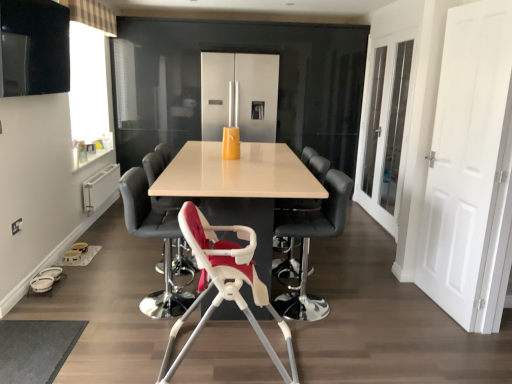
What do you see at coordinates (240, 94) in the screenshot? This screenshot has width=512, height=384. I see `satin silver fridge at center` at bounding box center [240, 94].

This screenshot has width=512, height=384. What do you see at coordinates (309, 244) in the screenshot?
I see `black leather bar stool at center, which is the 3th chair from back to front` at bounding box center [309, 244].

Consider the image. What is the approximate height of white plastic highchair at center, arranged as the fourth chair when viewed from the back?

It is 35.68 inches.

This screenshot has width=512, height=384. I want to click on black leather chair at center, the 5th chair in the front-to-back sequence, so click(x=286, y=258).

Measure the distance between point (166, 205) and camera.

The distance of point (166, 205) from camera is 10.29 feet.

Find the location of a particular element. The image size is (512, 384). matte white table at center is located at coordinates (240, 187).

From a real-world perspective, does satin silver fridge at center stand above white plastic highchair at center, the fifth chair when ordered from back to front?

Yes, from a real-world perspective, satin silver fridge at center is above white plastic highchair at center, the fifth chair when ordered from back to front.

Is satin silver fridge at center at the right side of white plastic highchair at center, the fifth chair when ordered from back to front?

Incorrect, satin silver fridge at center is not on the right side of white plastic highchair at center, the fifth chair when ordered from back to front.

Is satin silver fridge at center aimed at white plastic highchair at center, placed as the first chair when sorted from front to back?

Yes, satin silver fridge at center is aimed at white plastic highchair at center, placed as the first chair when sorted from front to back.

From their relative heights in the image, would you say satin silver fridge at center is taller or shorter than white plastic highchair at center, the fifth chair when ordered from back to front?

Considering their sizes, satin silver fridge at center has more height than white plastic highchair at center, the fifth chair when ordered from back to front.

Considering the positions of point (314, 233) and point (499, 2), is point (314, 233) closer or farther from the camera than point (499, 2)?

Point (314, 233) appears to be farther away from the viewer than point (499, 2).

From the image's perspective, relative to white matte door at right, is black leather bar stool at center, placed as the third chair when sorted from front to back, above or below?

Based on their image positions, black leather bar stool at center, placed as the third chair when sorted from front to back, is located beneath white matte door at right.

Which of these two, black leather bar stool at center, placed as the third chair when sorted from front to back, or white matte door at right, is bigger?

black leather bar stool at center, placed as the third chair when sorted from front to back.

What's the angular difference between black leather bar stool at center, which is the 3th chair from back to front, and white matte door at right's facing directions?

black leather bar stool at center, which is the 3th chair from back to front, and white matte door at right are facing 3.62 degrees away from each other.

Does satin silver fridge at center have a lesser width compared to black leather bar stool at center, which is the 3th chair from back to front?

Incorrect, the width of satin silver fridge at center is not less than that of black leather bar stool at center, which is the 3th chair from back to front.

Which is behind, satin silver fridge at center or black leather bar stool at center, placed as the third chair when sorted from front to back?

satin silver fridge at center is further from the camera.

From the image's perspective, would you say satin silver fridge at center is shown under black leather bar stool at center, which is the 3th chair from back to front?

Actually, satin silver fridge at center appears above black leather bar stool at center, which is the 3th chair from back to front, in the image.

From a real-world perspective, between satin silver fridge at center and black leather bar stool at center, placed as the third chair when sorted from front to back, who is vertically lower?

From a 3D spatial view, black leather bar stool at center, placed as the third chair when sorted from front to back, is below.

Which object is more forward, black leather chair at center, the 5th chair in the front-to-back sequence, or black leather bar stool at center, which is the 3th chair from back to front?

black leather bar stool at center, which is the 3th chair from back to front.

Is black leather chair at center, the first chair when ordered from back to front, aimed at black leather bar stool at center, placed as the third chair when sorted from front to back?

No, black leather chair at center, the first chair when ordered from back to front, does not turn towards black leather bar stool at center, placed as the third chair when sorted from front to back.

Looking at their sizes, would you say black leather chair at center, the 5th chair in the front-to-back sequence, is wider or thinner than black leather bar stool at center, placed as the third chair when sorted from front to back?

Clearly, black leather chair at center, the 5th chair in the front-to-back sequence, has less width compared to black leather bar stool at center, placed as the third chair when sorted from front to back.

From a real-world perspective, is black leather chair at center, the 5th chair in the front-to-back sequence, located beneath black leather bar stool at center, placed as the third chair when sorted from front to back?

Indeed, from a real-world perspective, black leather chair at center, the 5th chair in the front-to-back sequence, is positioned beneath black leather bar stool at center, placed as the third chair when sorted from front to back.

In terms of width, does white matte door at right look wider or thinner when compared to black leather bar stool at center, which is the 3th chair from back to front?

Clearly, white matte door at right has less width compared to black leather bar stool at center, which is the 3th chair from back to front.

Is black leather bar stool at center, placed as the third chair when sorted from front to back, surrounded by white matte door at right?

Definitely not — black leather bar stool at center, placed as the third chair when sorted from front to back, is not inside white matte door at right.

Consider the image. Which object is positioned more to the left, white matte door at right or black leather bar stool at center, placed as the third chair when sorted from front to back?

black leather bar stool at center, placed as the third chair when sorted from front to back, is more to the left.

Relative to white glass door at right, is black leather bar stool at center, placed as the third chair when sorted from front to back, in front or behind?

black leather bar stool at center, placed as the third chair when sorted from front to back, is in front of white glass door at right.

From the image's perspective, which one is positioned lower, black leather bar stool at center, which is the 3th chair from back to front, or white glass door at right?

black leather bar stool at center, which is the 3th chair from back to front, appears lower in the image.

Locate an element on the screen. The height and width of the screenshot is (384, 512). glass door that is behind the black leather bar stool at center, placed as the third chair when sorted from front to back is located at coordinates (385, 129).

Considering the sizes of objects black leather bar stool at center, placed as the third chair when sorted from front to back, and white glass door at right in the image provided, who is taller, black leather bar stool at center, placed as the third chair when sorted from front to back, or white glass door at right?

white glass door at right is taller.

Where is `table in front of the black leather chair at center, the first chair when ordered from back to front`? The height and width of the screenshot is (384, 512). table in front of the black leather chair at center, the first chair when ordered from back to front is located at coordinates pyautogui.click(x=240, y=187).

Is matte white table at center inside or outside of black leather chair at center, the 5th chair in the front-to-back sequence?

matte white table at center exists outside the volume of black leather chair at center, the 5th chair in the front-to-back sequence.

Is matte white table at center bigger or smaller than black leather chair at center, the 5th chair in the front-to-back sequence?

Considering their sizes, matte white table at center takes up more space than black leather chair at center, the 5th chair in the front-to-back sequence.

Is matte white table at center facing away from black leather chair at center, the 5th chair in the front-to-back sequence?

Yes, matte white table at center is positioned with its back facing black leather chair at center, the 5th chair in the front-to-back sequence.

The image size is (512, 384). Find the location of `chair that is the 5th object located in front of the satin silver fridge at center`. chair that is the 5th object located in front of the satin silver fridge at center is located at coordinates (224, 285).

The image size is (512, 384). I want to click on door above the black leather bar stool at center, placed as the third chair when sorted from front to back (from the image's perspective), so click(x=471, y=170).

Based on their spatial positions, is satin silver fridge at center or white glass door at right further from black leather bar stool at center, placed as the third chair when sorted from front to back?

satin silver fridge at center.

From the image, which object appears to be farther from black leather bar stool at center, placed as the third chair when sorted from front to back, white plastic highchair at center, positioned as the 2th chair in front-to-back order, or white glass door at right?

Based on the image, white glass door at right appears to be further to black leather bar stool at center, placed as the third chair when sorted from front to back.

Which object lies further to the anchor point matte black chair at center, which appears as the fourth chair when viewed from the front, white glass door at right or black leather chair at center, the 5th chair in the front-to-back sequence?

The object further to matte black chair at center, which appears as the fourth chair when viewed from the front, is white glass door at right.

Looking at the image, which one is located closer to white matte door at right, white plastic highchair at center, placed as the first chair when sorted from front to back, or black leather chair at center, the 5th chair in the front-to-back sequence?

Among the two, black leather chair at center, the 5th chair in the front-to-back sequence, is located nearer to white matte door at right.

Looking at this image, estimate the real-world distances between objects in this image. Which object is further from matte white table at center, satin silver fridge at center or white matte door at right?

satin silver fridge at center is positioned further to the anchor matte white table at center.

Estimate the real-world distances between objects in this image. Which object is further from white plastic highchair at center, positioned as the 2th chair in front-to-back order, white plastic highchair at center, placed as the first chair when sorted from front to back, or white glass door at right?

Based on the image, white glass door at right appears to be further to white plastic highchair at center, positioned as the 2th chair in front-to-back order.

Estimate the real-world distances between objects in this image. Which object is closer to black leather chair at center, the first chair when ordered from back to front, white matte door at right or black leather bar stool at center, placed as the third chair when sorted from front to back?

Based on the image, black leather bar stool at center, placed as the third chair when sorted from front to back, appears to be nearer to black leather chair at center, the first chair when ordered from back to front.

When comparing their distances from white plastic highchair at center, arranged as the fourth chair when viewed from the back, does satin silver fridge at center or matte white table at center seem closer?

Among the two, matte white table at center is located nearer to white plastic highchair at center, arranged as the fourth chair when viewed from the back.

Locate an element on the screen. glass door positioned between black leather bar stool at center, placed as the third chair when sorted from front to back, and satin silver fridge at center from near to far is located at coordinates (385, 129).

Locate an element on the screen. door between white plastic highchair at center, arranged as the fourth chair when viewed from the back, and white glass door at right, in the horizontal direction is located at coordinates (471, 170).

At what (x,y) coordinates should I click in order to perform the action: click on glass door positioned between white plastic highchair at center, arranged as the fourth chair when viewed from the back, and satin silver fridge at center from near to far. Please return your answer as a coordinate pair (x, y). Image resolution: width=512 pixels, height=384 pixels. Looking at the image, I should click on pos(385,129).

Identify the location of table positioned between white plastic highchair at center, the fifth chair when ordered from back to front, and satin silver fridge at center from near to far. Image resolution: width=512 pixels, height=384 pixels. (240, 187).